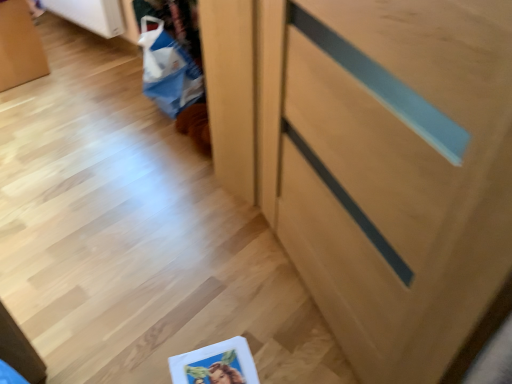
Image resolution: width=512 pixels, height=384 pixels. Describe the element at coordinates (374, 161) in the screenshot. I see `light wood cabinet at center` at that location.

Identify the location of light wood cabinet at center. This screenshot has width=512, height=384. (374, 161).

In the scene shown: In order to face light wood cabinet at center, should I rotate leftwards or rightwards?

A 8.145 degree turn to the right will do.

This screenshot has height=384, width=512. I want to click on blue paper bag at lower left, so click(168, 70).

What do you see at coordinates (168, 70) in the screenshot? I see `blue paper bag at lower left` at bounding box center [168, 70].

This screenshot has width=512, height=384. In order to click on light wood cabinet at center in this screenshot , I will do `click(374, 161)`.

Considering the positions of objects light wood cabinet at center and blue paper bag at lower left in the image provided, who is more to the left, light wood cabinet at center or blue paper bag at lower left?

blue paper bag at lower left is more to the left.

Based on the photo, which object is closer to the camera taking this photo, light wood cabinet at center or blue paper bag at lower left?

light wood cabinet at center.

Is point (237, 82) farther from camera compared to point (163, 87)?

That is False.

From the image's perspective, is light wood cabinet at center located above or below blue paper bag at lower left?

Based on their image positions, light wood cabinet at center is located beneath blue paper bag at lower left.

From a real-world perspective, is light wood cabinet at center physically above blue paper bag at lower left?

Yes.

Which object is thinner, light wood cabinet at center or blue paper bag at lower left?

light wood cabinet at center is thinner.

In terms of height, does light wood cabinet at center look taller or shorter compared to blue paper bag at lower left?

Considering their sizes, light wood cabinet at center has more height than blue paper bag at lower left.

Who is smaller, light wood cabinet at center or blue paper bag at lower left?

With smaller size is blue paper bag at lower left.

Is light wood cabinet at center outside of blue paper bag at lower left?

Indeed, light wood cabinet at center is completely outside blue paper bag at lower left.

Is light wood cabinet at center not near blue paper bag at lower left?

No, there isn't a large distance between light wood cabinet at center and blue paper bag at lower left.

Could you tell me if light wood cabinet at center is facing blue paper bag at lower left?

No.

How different are the orientations of light wood cabinet at center and blue paper bag at lower left in degrees?

There is a 24.9-degree angle between the facing directions of light wood cabinet at center and blue paper bag at lower left.

Identify the location of cabinetry located above the blue paper bag at lower left (from a real-world perspective). (374, 161).

Which object is positioned more to the left, blue paper bag at lower left or light wood cabinet at center?

blue paper bag at lower left is more to the left.

Who is more distant, blue paper bag at lower left or light wood cabinet at center?

Positioned behind is blue paper bag at lower left.

Which is in front, point (185, 60) or point (369, 220)?

The point (369, 220) is closer.

From the image's perspective, does blue paper bag at lower left appear lower than light wood cabinet at center?

No.

From a real-world perspective, relative to light wood cabinet at center, is blue paper bag at lower left vertically above or below?

blue paper bag at lower left is below light wood cabinet at center.

Between blue paper bag at lower left and light wood cabinet at center, which one has smaller width?

light wood cabinet at center is thinner.

Considering the sizes of blue paper bag at lower left and light wood cabinet at center in the image, is blue paper bag at lower left taller or shorter than light wood cabinet at center?

blue paper bag at lower left is shorter than light wood cabinet at center.

Considering the relative sizes of blue paper bag at lower left and light wood cabinet at center in the image provided, is blue paper bag at lower left bigger than light wood cabinet at center?

No.

Is blue paper bag at lower left inside or outside of light wood cabinet at center?

The correct answer is: outside.

Are blue paper bag at lower left and light wood cabinet at center making contact?

blue paper bag at lower left and light wood cabinet at center are clearly separated.

Consider the image. Is blue paper bag at lower left facing towards light wood cabinet at center?

No, blue paper bag at lower left is not oriented towards light wood cabinet at center.

Looking at this image, can you tell me how much blue paper bag at lower left and light wood cabinet at center differ in facing direction?

24.9 degrees separate the facing orientations of blue paper bag at lower left and light wood cabinet at center.

Image resolution: width=512 pixels, height=384 pixels. What are the coordinates of `shopping bag behind the light wood cabinet at center` in the screenshot? It's located at (168, 70).

Where is `shopping bag above the light wood cabinet at center (from the image's perspective)`? Image resolution: width=512 pixels, height=384 pixels. shopping bag above the light wood cabinet at center (from the image's perspective) is located at coordinates (168, 70).

Where is `cabinetry positioned vertically above the blue paper bag at lower left (from a real-world perspective)`? The width and height of the screenshot is (512, 384). cabinetry positioned vertically above the blue paper bag at lower left (from a real-world perspective) is located at coordinates (374, 161).